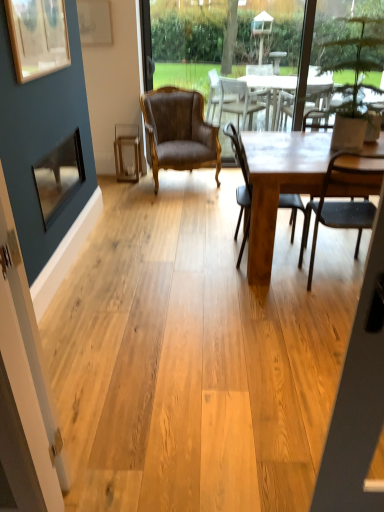
Find the location of a particular element. This screenshot has height=512, width=384. free point in front of wooden table at center is located at coordinates (275, 333).